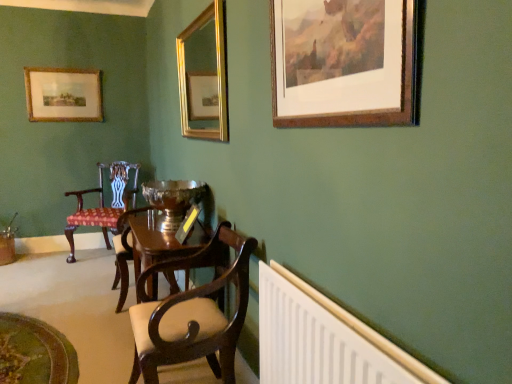
Question: From a real-world perspective, is gold metallic mirror at upper center, the second picture frame viewed from the back, beneath polka dot fabric chair at left, which is the first chair from left to right?

Choices:
 (A) no
 (B) yes

Answer: (A)

Question: Is gold metallic mirror at upper center, the 2th picture frame when ordered from front to back, facing away from polka dot fabric chair at left, which ranks as the 1th chair in back-to-front order?

Choices:
 (A) yes
 (B) no

Answer: (B)

Question: Is polka dot fabric chair at left, which is counted as the 2th chair, starting from the front, located within gold metallic mirror at upper center, the 2th picture frame when ordered from front to back?

Choices:
 (A) yes
 (B) no

Answer: (B)

Question: Does gold metallic mirror at upper center, which is the 2th picture frame from right to left, have a lesser width compared to polka dot fabric chair at left, the second chair positioned from the right?

Choices:
 (A) yes
 (B) no

Answer: (A)

Question: Is the depth of gold metallic mirror at upper center, the second picture frame viewed from the back, less than that of polka dot fabric chair at left, the second chair positioned from the right?

Choices:
 (A) no
 (B) yes

Answer: (B)

Question: Does gold metallic mirror at upper center, which is the 2th picture frame from right to left, appear on the left side of polka dot fabric chair at left, which is the first chair from left to right?

Choices:
 (A) no
 (B) yes

Answer: (A)

Question: Considering the relative sizes of white plastic radiator at lower right and brown wooden picture frame at upper right, arranged as the first picture frame when viewed from the right, in the image provided, is white plastic radiator at lower right wider than brown wooden picture frame at upper right, arranged as the first picture frame when viewed from the right,?

Choices:
 (A) no
 (B) yes

Answer: (B)

Question: From the image's perspective, is white plastic radiator at lower right located beneath brown wooden picture frame at upper right, which is the 3th picture frame in left-to-right order?

Choices:
 (A) yes
 (B) no

Answer: (A)

Question: From the image's perspective, does white plastic radiator at lower right appear higher than brown wooden picture frame at upper right, the first picture frame from the front?

Choices:
 (A) yes
 (B) no

Answer: (B)

Question: From a real-world perspective, is white plastic radiator at lower right located beneath brown wooden picture frame at upper right, the first picture frame from the front?

Choices:
 (A) yes
 (B) no

Answer: (A)

Question: From a real-world perspective, is white plastic radiator at lower right positioned over brown wooden picture frame at upper right, arranged as the first picture frame when viewed from the right, based on gravity?

Choices:
 (A) no
 (B) yes

Answer: (A)

Question: Considering the relative sizes of white plastic radiator at lower right and brown wooden picture frame at upper right, arranged as the first picture frame when viewed from the right, in the image provided, is white plastic radiator at lower right smaller than brown wooden picture frame at upper right, arranged as the first picture frame when viewed from the right,?

Choices:
 (A) yes
 (B) no

Answer: (B)

Question: Considering the relative positions of mahogany wood chair at center, placed as the 2th chair when sorted from back to front, and wooden picture frame at upper left, the third picture frame positioned from the front, in the image provided, is mahogany wood chair at center, placed as the 2th chair when sorted from back to front, behind wooden picture frame at upper left, the third picture frame positioned from the front,?

Choices:
 (A) yes
 (B) no

Answer: (B)